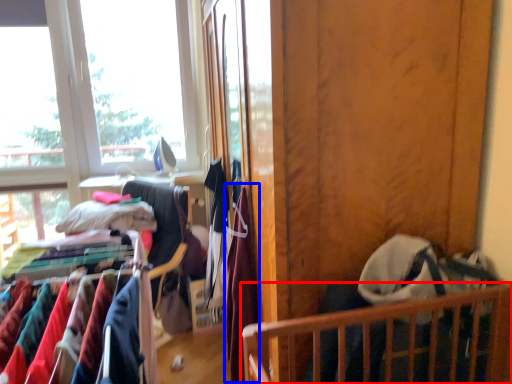
Question: Which point is closer to the camera, furniture (highlighted by a red box) or clothing (highlighted by a blue box)?

Choices:
 (A) furniture
 (B) clothing

Answer: (A)